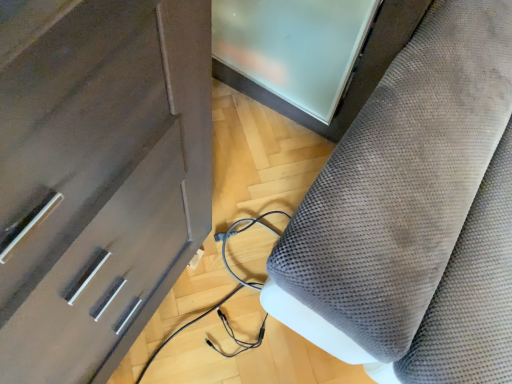
What do you see at coordinates (97, 175) in the screenshot? Image resolution: width=512 pixels, height=384 pixels. I see `matte gray chest of drawers at left` at bounding box center [97, 175].

You are a GUI agent. You are given a task and a screenshot of the screen. Output one action in this format:
    pyautogui.click(x=<x>, y=<y>)
    Task: Click on the matte gray chest of drawers at left
    Image resolution: width=512 pixels, height=384 pixels.
    Given the screenshot: What is the action you would take?
    pyautogui.click(x=97, y=175)

The width and height of the screenshot is (512, 384). In order to click on matte gray chest of drawers at left in this screenshot , I will do `click(97, 175)`.